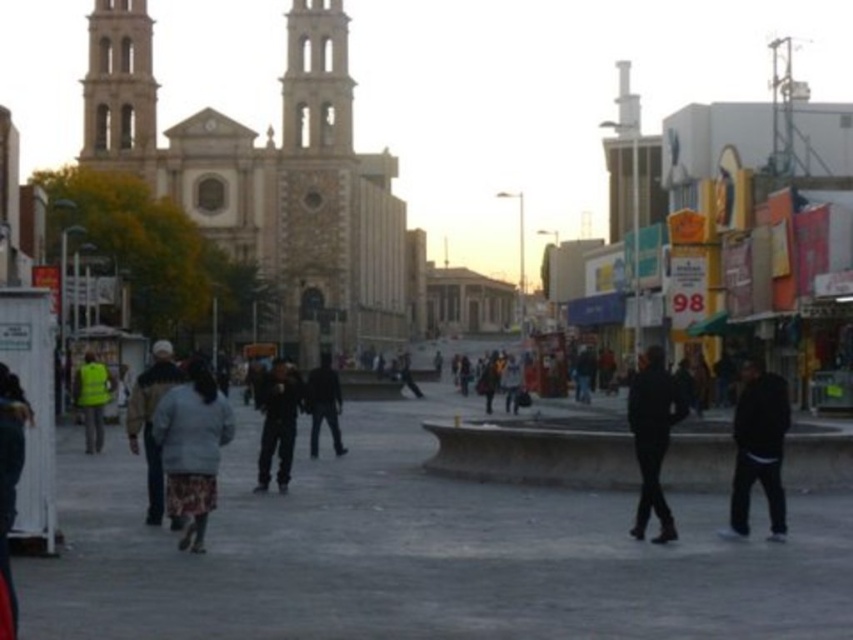
Question: Which point is closer to the camera?

Choices:
 (A) dark gray jacket at center
 (B) light beige stone tower at upper left
 (C) high visibility yellow vest at lower left
 (D) dark clothing figure at center

Answer: (A)

Question: Which point is farther to the camera?

Choices:
 (A) dark gray pants at center
 (B) dark clothing figure at center
 (C) high visibility yellow vest at lower left
 (D) light beige stone tower at upper left

Answer: (D)

Question: Is dark gray pants at center further to camera compared to high visibility yellow vest at lower left?

Choices:
 (A) no
 (B) yes

Answer: (A)

Question: Based on their relative distances, which object is nearer to the black matte pants at center?

Choices:
 (A) dark gray pants at center
 (B) black matte pants at right
 (C) gray woolen sweater at center
 (D) light beige stone tower at upper left

Answer: (B)

Question: Does black matte pants at right come behind dark gray jacket at center?

Choices:
 (A) yes
 (B) no

Answer: (B)

Question: In this image, where is light beige stone tower at upper left located relative to black matte pants at right?

Choices:
 (A) below
 (B) above

Answer: (B)